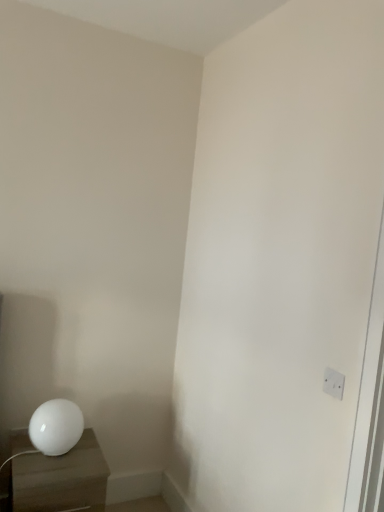
Question: Does white plastic electric outlet at upper right have a larger size compared to white glossy sphere at lower left?

Choices:
 (A) yes
 (B) no

Answer: (B)

Question: From a real-world perspective, is white plastic electric outlet at upper right physically below white glossy sphere at lower left?

Choices:
 (A) no
 (B) yes

Answer: (A)

Question: Does white plastic electric outlet at upper right have a greater width compared to white glossy sphere at lower left?

Choices:
 (A) no
 (B) yes

Answer: (A)

Question: Is white plastic electric outlet at upper right outside white glossy sphere at lower left?

Choices:
 (A) no
 (B) yes

Answer: (B)

Question: Is white glossy sphere at lower left completely or partially inside white plastic electric outlet at upper right?

Choices:
 (A) no
 (B) yes

Answer: (A)

Question: From a real-world perspective, is white plastic electric outlet at upper right positioned above or below white glossy sphere at lower left?

Choices:
 (A) above
 (B) below

Answer: (A)

Question: Based on their positions, is white plastic electric outlet at upper right located to the left or right of white glossy sphere at lower left?

Choices:
 (A) right
 (B) left

Answer: (A)

Question: Is white plastic electric outlet at upper right inside the boundaries of white glossy sphere at lower left, or outside?

Choices:
 (A) outside
 (B) inside

Answer: (A)

Question: Looking at their shapes, would you say white plastic electric outlet at upper right is wider or thinner than white glossy sphere at lower left?

Choices:
 (A) wide
 (B) thin

Answer: (B)

Question: Relative to white plastic electric outlet at upper right, is white glossy sphere at lower left in front or behind?

Choices:
 (A) behind
 (B) front

Answer: (A)

Question: From the image's perspective, is white glossy sphere at lower left located above or below white plastic electric outlet at upper right?

Choices:
 (A) above
 (B) below

Answer: (B)

Question: From a real-world perspective, is white glossy sphere at lower left above or below white plastic electric outlet at upper right?

Choices:
 (A) above
 (B) below

Answer: (B)

Question: Considering the positions of white glossy sphere at lower left and white plastic electric outlet at upper right in the image, is white glossy sphere at lower left wider or thinner than white plastic electric outlet at upper right?

Choices:
 (A) thin
 (B) wide

Answer: (B)

Question: From the image's perspective, is white glossy nightstand at lower left above or below white glossy sphere at lower left?

Choices:
 (A) below
 (B) above

Answer: (A)

Question: From a real-world perspective, is white glossy nightstand at lower left positioned above or below white glossy sphere at lower left?

Choices:
 (A) below
 (B) above

Answer: (A)